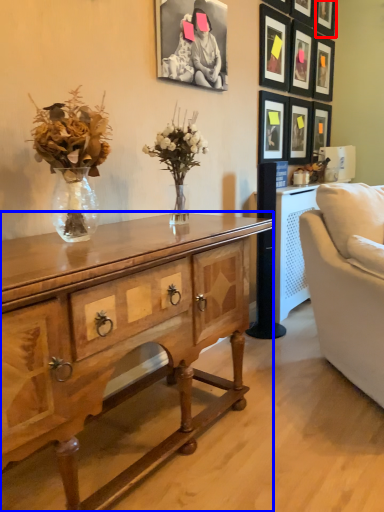
Question: Which object appears farthest to the camera in this image, picture frame (highlighted by a red box) or desk (highlighted by a blue box)?

Choices:
 (A) picture frame
 (B) desk

Answer: (A)